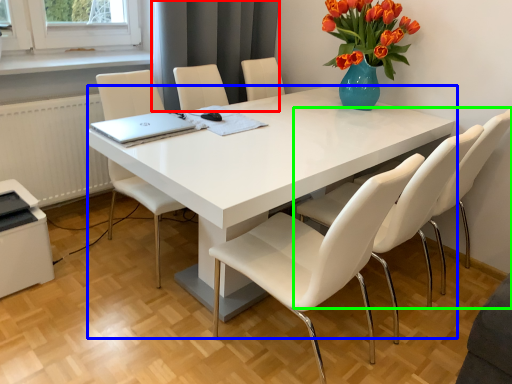
Question: Which object is the closest to the curtain (highlighted by a red box)? Choose among these: table (highlighted by a blue box) or chair (highlighted by a green box).

Choices:
 (A) table
 (B) chair

Answer: (A)